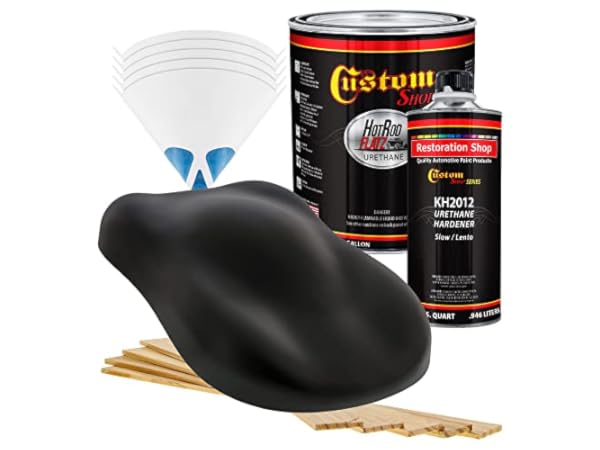
Identify the location of wood grain. (376, 422), (335, 422), (428, 427), (453, 432), (492, 426).